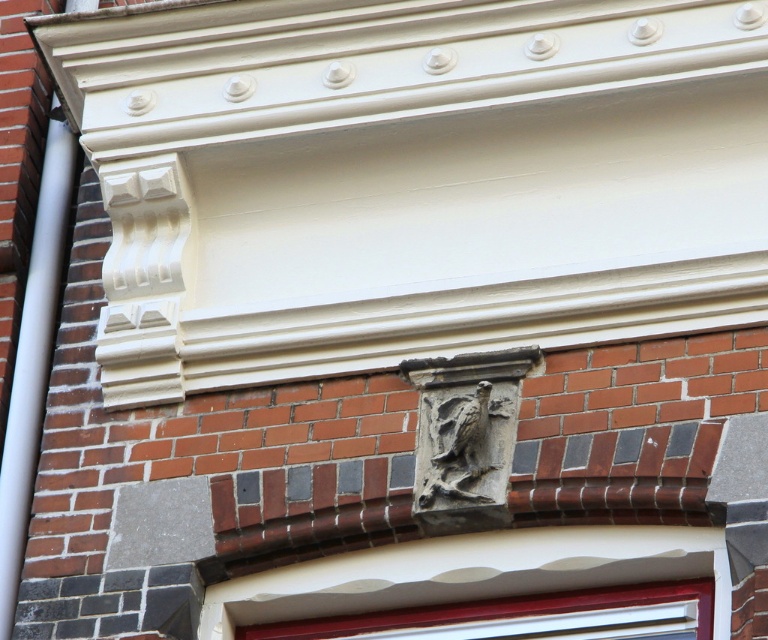
Does white painted wood at lower center have a greater height compared to gray stone eagle at center?

No, white painted wood at lower center is not taller than gray stone eagle at center.

Which is in front, point (303, 625) or point (439, 433)?

Positioned in front is point (439, 433).

Where is `white painted wood at lower center`? Image resolution: width=768 pixels, height=640 pixels. white painted wood at lower center is located at coordinates (505, 614).